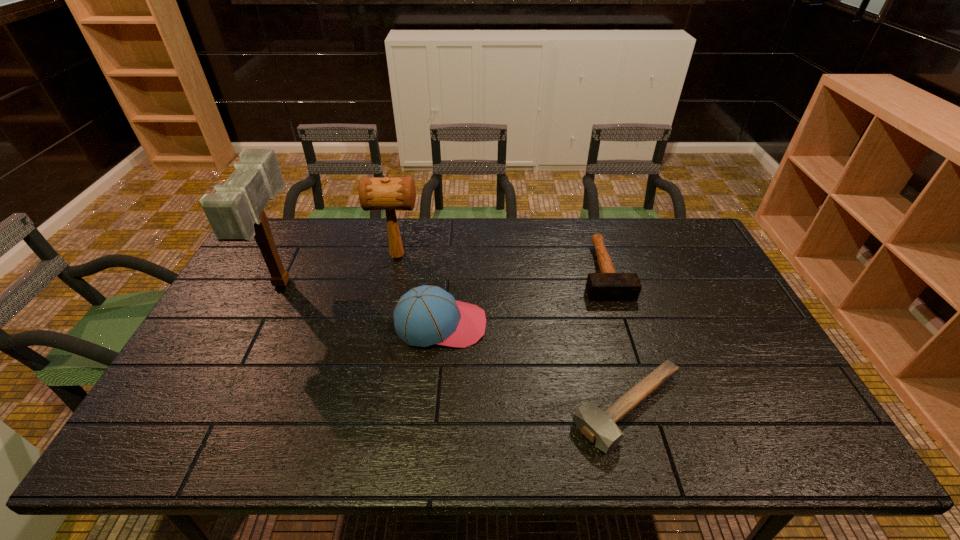
At what (x,y) coordinates should I click in order to perform the action: click on vacant space positioned 0.210m on the front-facing side of the third shortest object. Please return your answer as a coordinate pair (x, y). The image size is (960, 540). Looking at the image, I should click on (560, 325).

Where is `free space located 0.400m on the hammer head face of the third tallest mallet`? free space located 0.400m on the hammer head face of the third tallest mallet is located at coordinates (651, 422).

Where is `vacant area situated 0.280m on the back of the shortest mallet`? vacant area situated 0.280m on the back of the shortest mallet is located at coordinates (596, 293).

Image resolution: width=960 pixels, height=540 pixels. Find the location of `object located in the near edge section of the desktop`. object located in the near edge section of the desktop is located at coordinates (599, 427).

You are a GUI agent. You are given a task and a screenshot of the screen. Output one action in this format:
    pyautogui.click(x=<x>, y=<y>)
    Task: Click on the object situated at the left edge
    Image resolution: width=960 pixels, height=540 pixels.
    Given the screenshot: What is the action you would take?
    (x=235, y=212)

I want to click on object located in the far left corner section of the desktop, so click(235, 212).

Locate an element on the screen. The image size is (960, 540). free space at the far edge of the desktop is located at coordinates (546, 227).

At what (x,y) coordinates should I click in order to perform the action: click on vacant space at the near edge. Please return your answer as a coordinate pair (x, y). Image resolution: width=960 pixels, height=540 pixels. Looking at the image, I should click on (544, 451).

Find the location of a particular element. free space at the left edge is located at coordinates (252, 301).

Identify the location of vacant point at the right edge. (721, 316).